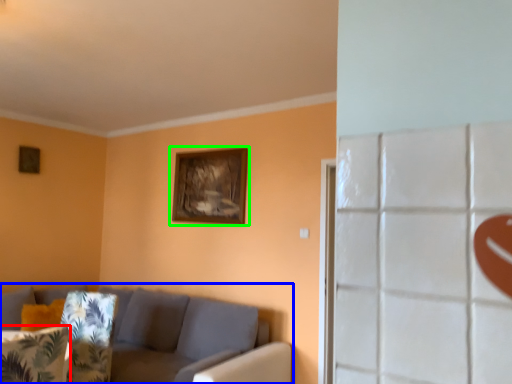
Question: Which object is positioned farthest from pillow (highlighted by a red box)? Select from studio couch (highlighted by a blue box) and picture frame (highlighted by a green box).

Choices:
 (A) studio couch
 (B) picture frame

Answer: (B)